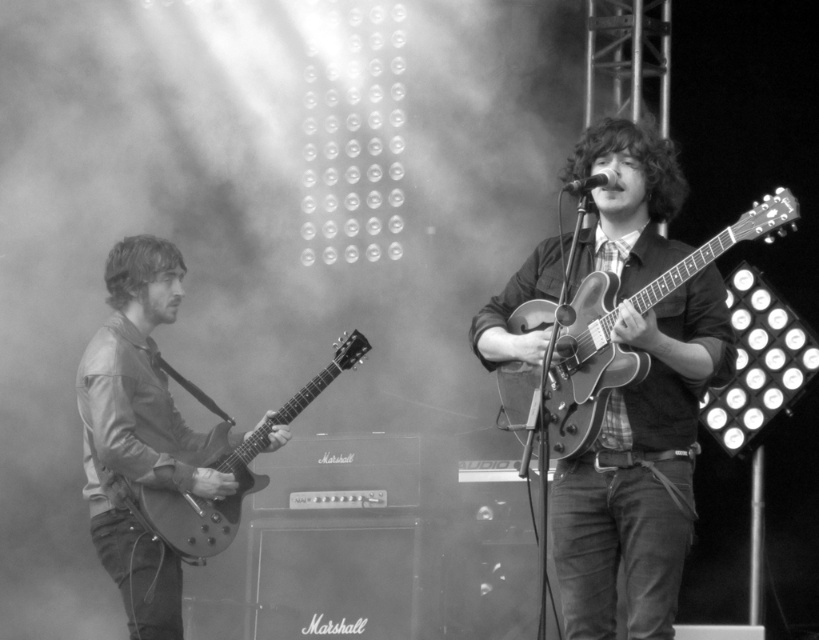
You are a photographer positioned at the center of the stage. You want to capture a closeup shot of the matte guitar at center. Given that your camera has a focal length of 50mm and you need to be within 2 meters to get a clear shot, can you determine if you are close enough based on the coordinates provided?

The matte guitar at center is located at coordinates point (637, 401). However, without knowing the actual distance scale of the coordinate system, it is impossible to determine if the photographer is within 2 meters to capture a clear shot.

You are a photographer positioned at the back of the stage. You want to capture a photo that includes both the matte black guitar at left and the matte wood guitar at center. Based on their positions, which guitar should you adjust your camera focus to first to ensure both are in the frame?

The matte black guitar at left is to the left of the matte wood guitar at center, so you should focus on the matte wood guitar at center first as it is closer to the center of the stage and will help frame both guitars effectively.

You are a photographer positioned at the back of the stage. You want to capture a photo that includes both the matte wood guitar at center and the glossy wood guitar at left. Based on their positions, which guitar should you adjust your camera angle to focus on first to ensure both are in frame?

The glossy wood guitar at left is positioned to the left of the matte wood guitar at center. To include both in the frame, adjust your camera angle to focus on the glossy wood guitar at left first, then ensure the matte wood guitar at center is captured to its right.